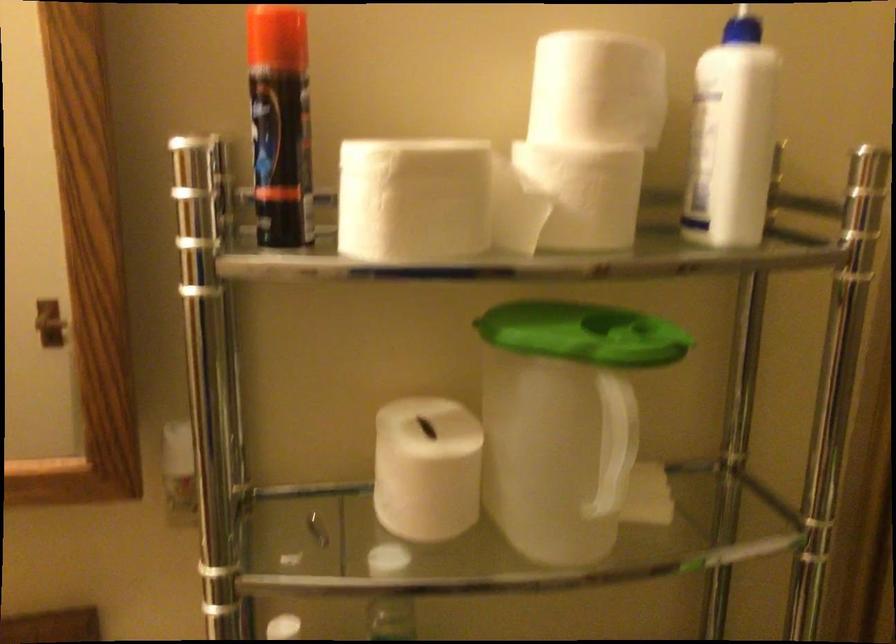
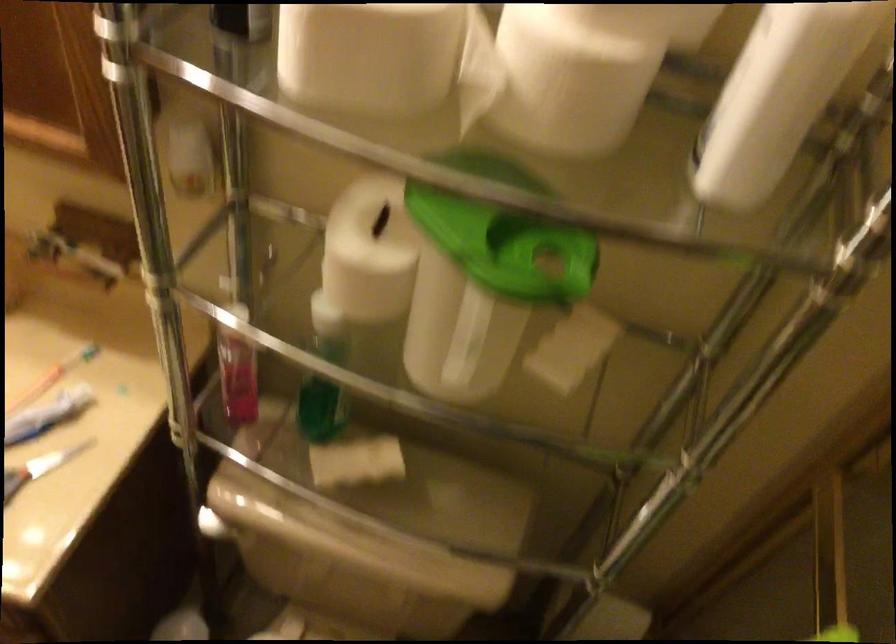
Locate, in the second image, the point that corresponds to point (606, 182) in the first image.

(575, 73)